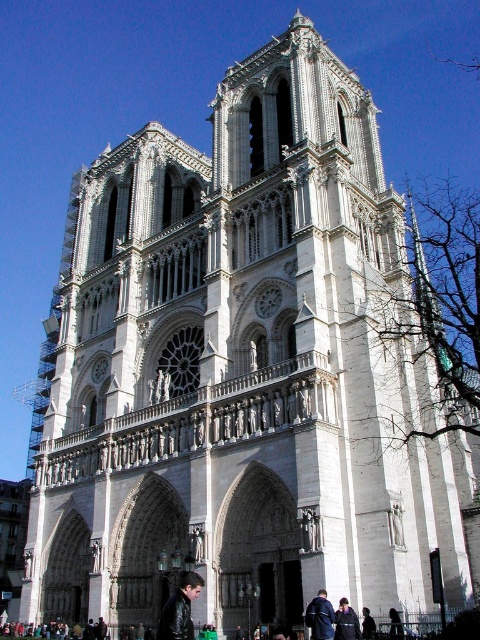
Question: Which of the following is the closest to the observer?

Choices:
 (A) (362, 628)
 (B) (352, 621)
 (C) (324, 608)

Answer: (C)

Question: Observing the image, what is the correct spatial positioning of dark blue leather jacket at lower right in reference to dark brown leather jacket at lower right?

Choices:
 (A) above
 (B) below

Answer: (A)

Question: Is dark blue leather jacket at lower right to the right of dark brown leather jacket at lower right from the viewer's perspective?

Choices:
 (A) no
 (B) yes

Answer: (A)

Question: Is leather jacket at lower center closer to camera compared to dark blue leather jacket at lower right?

Choices:
 (A) no
 (B) yes

Answer: (B)

Question: Which of these objects is positioned closest to the dark brown leather jacket at lower right?

Choices:
 (A) leather jacket at lower center
 (B) dark blue leather jacket at lower right

Answer: (B)

Question: Which object is closer to the camera taking this photo?

Choices:
 (A) dark brown leather jacket at lower right
 (B) dark blue leather jacket at lower center

Answer: (B)